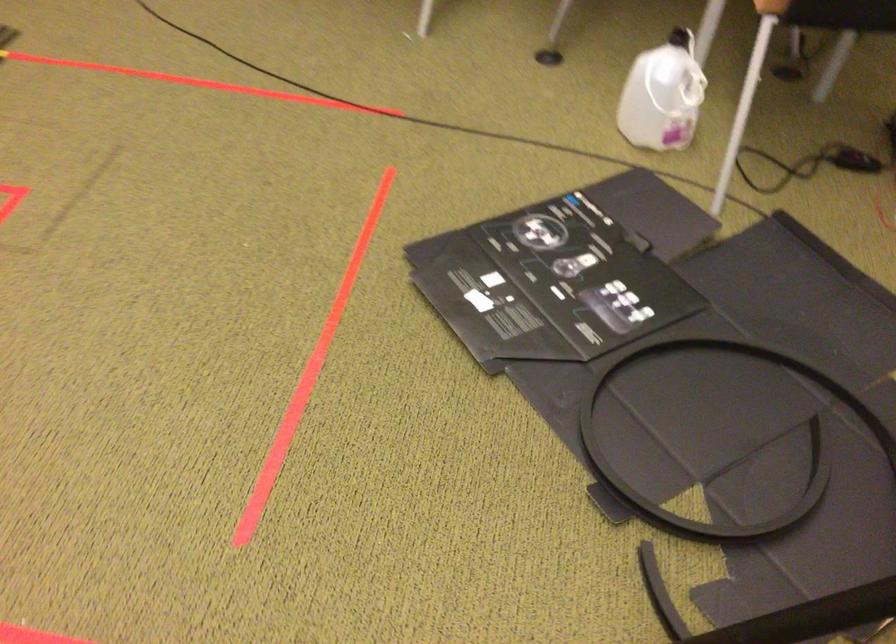
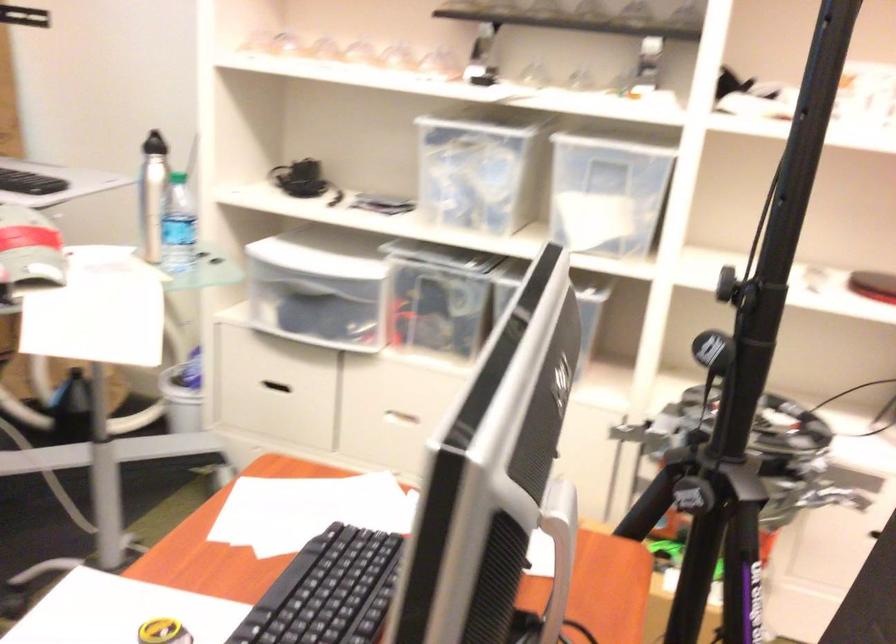
Question: The first image is from the beginning of the video and the second image is from the end. How did the camera likely rotate when shooting the video?

Choices:
 (A) Left
 (B) Right
 (C) Up
 (D) Down

Answer: (A)